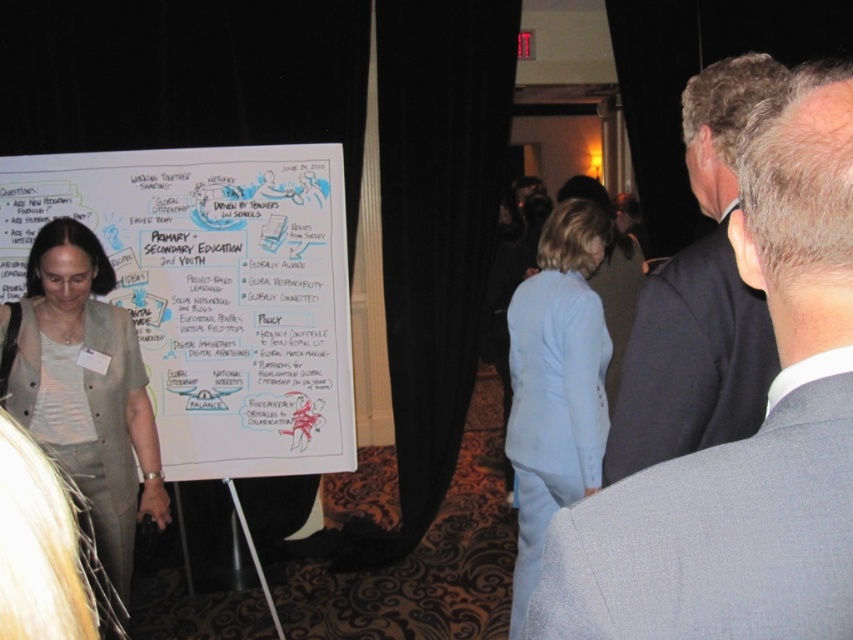
Question: Which object is the farthest from the gray suit at center?

Choices:
 (A) light blue fabric suit at center
 (B) dark suit at center
 (C) light beige fabric jacket at left

Answer: (C)

Question: Can you confirm if gray suit at center is bigger than light beige fabric jacket at left?

Choices:
 (A) yes
 (B) no

Answer: (B)

Question: Estimate the real-world distances between objects in this image. Which object is closer to the gray suit at center?

Choices:
 (A) light beige fabric jacket at left
 (B) dark suit at center
 (C) light blue fabric suit at center
 (D) whiteboard at center

Answer: (B)

Question: Which object is positioned farthest from the light beige fabric jacket at left?

Choices:
 (A) light blue fabric suit at center
 (B) dark suit at center

Answer: (B)

Question: Does dark suit at center have a lesser width compared to light blue fabric suit at center?

Choices:
 (A) yes
 (B) no

Answer: (A)

Question: Is dark suit at center below light beige fabric jacket at left?

Choices:
 (A) no
 (B) yes

Answer: (A)